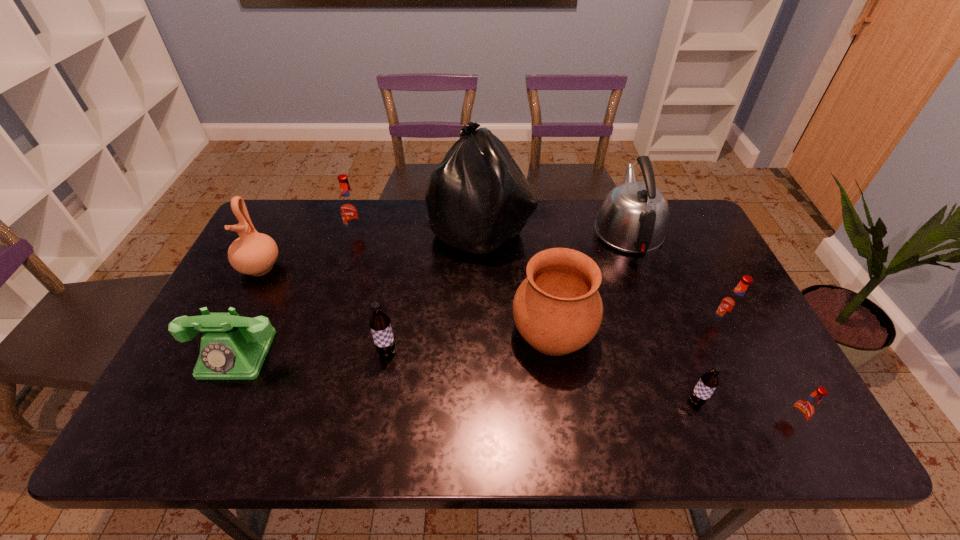
Where is `kettle that is at the right edge`? kettle that is at the right edge is located at coordinates (633, 218).

What are the coordinates of `object located in the far right corner section of the desktop` in the screenshot? It's located at (633, 218).

The height and width of the screenshot is (540, 960). I want to click on object that is at the near right corner, so click(804, 408).

In the image, there is a desktop. In order to click on free space at the far edge in this screenshot , I will do `click(577, 238)`.

Where is `free space at the near edge of the desktop`? free space at the near edge of the desktop is located at coordinates (386, 412).

Locate an element on the screen. This screenshot has height=540, width=960. free spot at the left edge of the desktop is located at coordinates (290, 247).

Image resolution: width=960 pixels, height=540 pixels. In the image, there is a desktop. Identify the location of vacant space at the right edge. (675, 274).

The width and height of the screenshot is (960, 540). In the image, there is a desktop. What are the coordinates of `vacant area at the far left corner` in the screenshot? It's located at (267, 231).

In the image, there is a desktop. At what (x,y) coordinates should I click in order to perform the action: click on vacant space at the far right corner. Please return your answer as a coordinate pair (x, y). The height and width of the screenshot is (540, 960). Looking at the image, I should click on (693, 235).

The width and height of the screenshot is (960, 540). I want to click on free spot between the third object from left to right and the left pottery, so click(x=308, y=251).